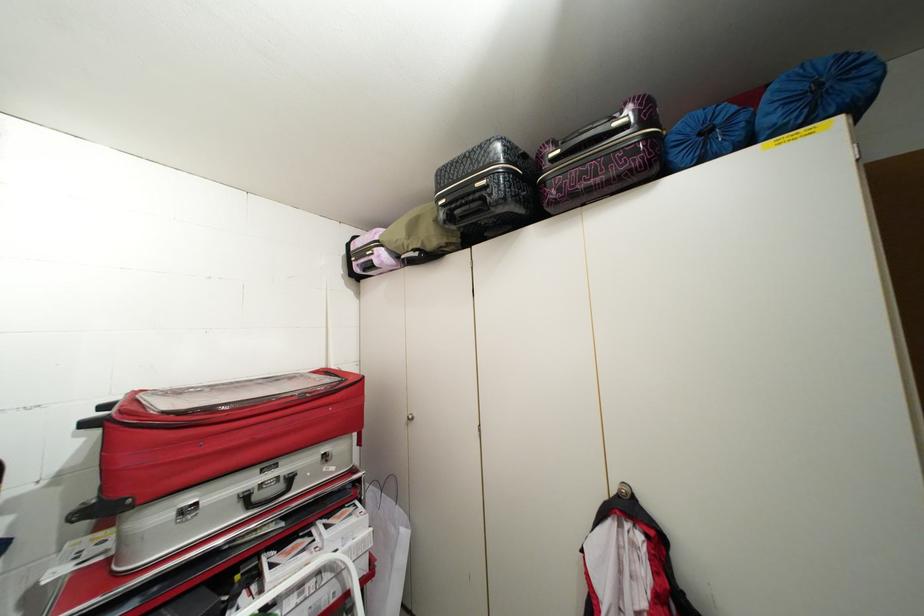
Locate an element on the screen. silver cabinet knob is located at coordinates (409, 416).